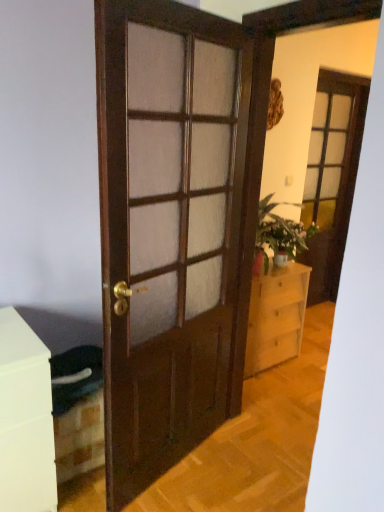
Where is `free space in front of wooden door at center`? This screenshot has height=512, width=384. free space in front of wooden door at center is located at coordinates (170, 486).